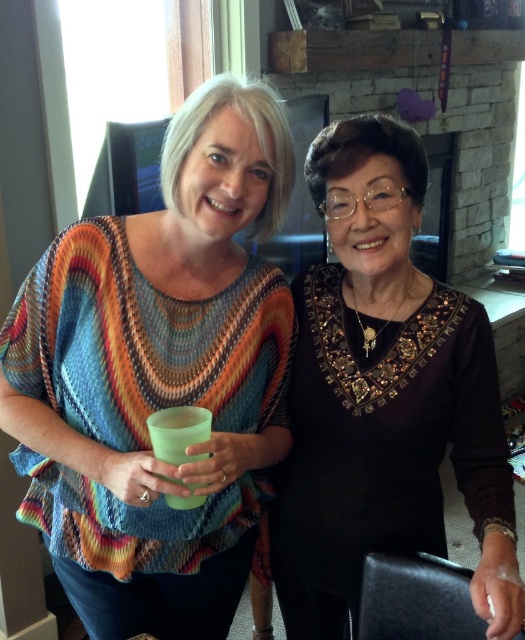
You are a photographer setting up a shoot and need to arrange two items in the scene. You have a matte green glass at center and a black sequined blouse at center. According to the scene description, which item is smaller in size?

The matte green glass at center is smaller in size compared to the black sequined blouse at center.

Looking at this image, you are standing in the room where the two women are. You want to place a small plant on the matte green glass at center. Is there enough space for the plant?

The matte green glass at center is located at point (159,376). Since the coordinates are provided, it implies the glass is a specific location, so placing a small plant there should be possible as long as the glass is flat and stable. However, the description does not mention the size of the glass, so we cannot confirm if the plant will fit.